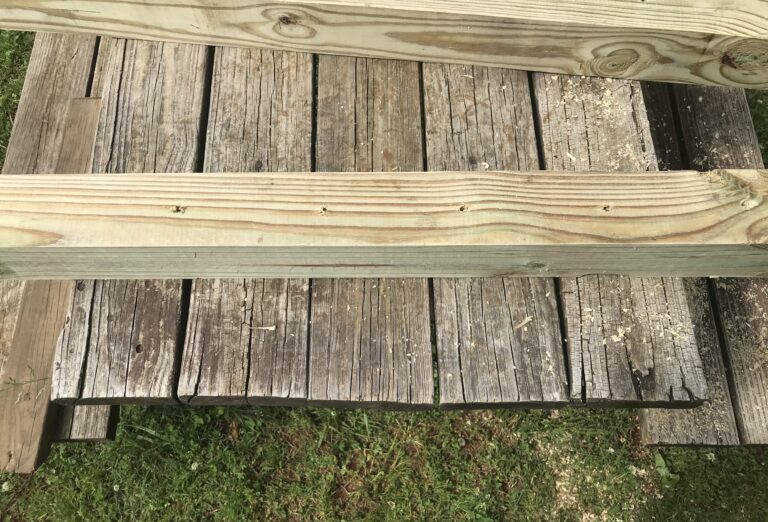
Where is `nail holes`? This screenshot has height=522, width=768. nail holes is located at coordinates (174, 209), (323, 211), (464, 208), (577, 209).